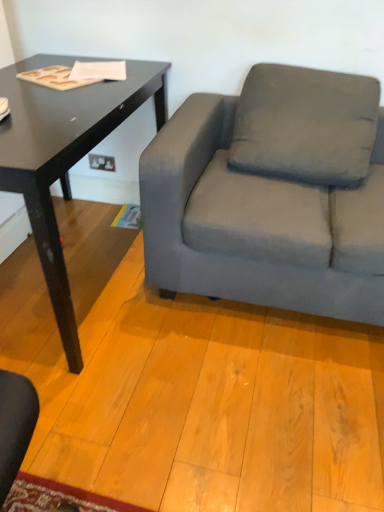
Question: Can you confirm if gray fabric pillow at center is smaller than gray fabric couch at right?

Choices:
 (A) yes
 (B) no

Answer: (A)

Question: Is gray fabric pillow at center in front of gray fabric couch at right?

Choices:
 (A) no
 (B) yes

Answer: (A)

Question: Is gray fabric pillow at center further to camera compared to gray fabric couch at right?

Choices:
 (A) yes
 (B) no

Answer: (A)

Question: Considering the relative sizes of gray fabric pillow at center and gray fabric couch at right in the image provided, is gray fabric pillow at center wider than gray fabric couch at right?

Choices:
 (A) yes
 (B) no

Answer: (B)

Question: Does gray fabric pillow at center have a larger size compared to gray fabric couch at right?

Choices:
 (A) no
 (B) yes

Answer: (A)

Question: Can you confirm if gray fabric pillow at center is shorter than gray fabric couch at right?

Choices:
 (A) yes
 (B) no

Answer: (A)

Question: Is gray fabric pillow at center at the right side of black glossy table at left?

Choices:
 (A) no
 (B) yes

Answer: (B)

Question: Is gray fabric pillow at center aimed at black glossy table at left?

Choices:
 (A) yes
 (B) no

Answer: (B)

Question: Is gray fabric pillow at center thinner than black glossy table at left?

Choices:
 (A) yes
 (B) no

Answer: (A)

Question: Is gray fabric pillow at center far away from black glossy table at left?

Choices:
 (A) yes
 (B) no

Answer: (B)

Question: Does gray fabric pillow at center touch black glossy table at left?

Choices:
 (A) no
 (B) yes

Answer: (A)

Question: Considering the relative positions of gray fabric pillow at center and black glossy table at left in the image provided, is gray fabric pillow at center to the left of black glossy table at left from the viewer's perspective?

Choices:
 (A) no
 (B) yes

Answer: (A)

Question: Can you confirm if black glossy table at left is shorter than gray fabric couch at right?

Choices:
 (A) no
 (B) yes

Answer: (B)